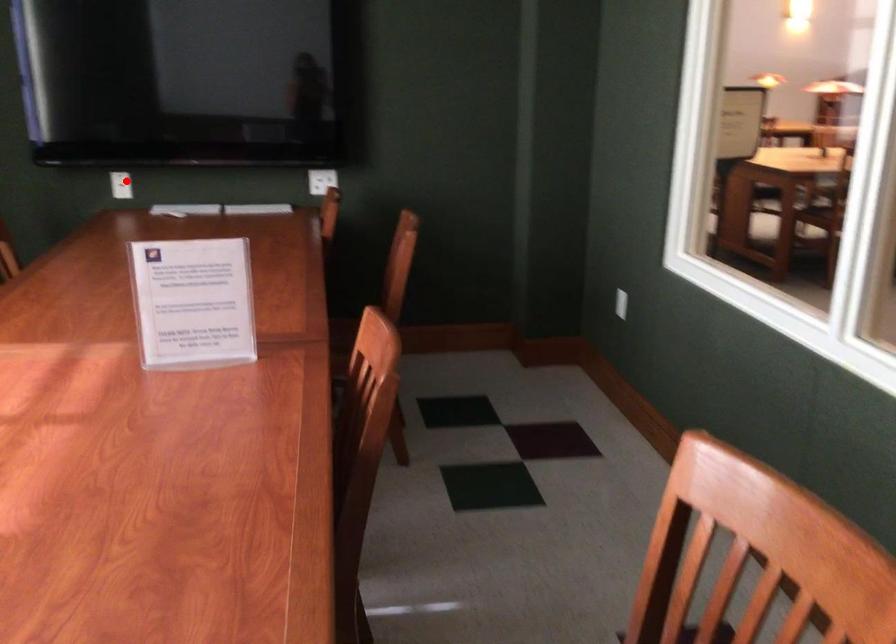
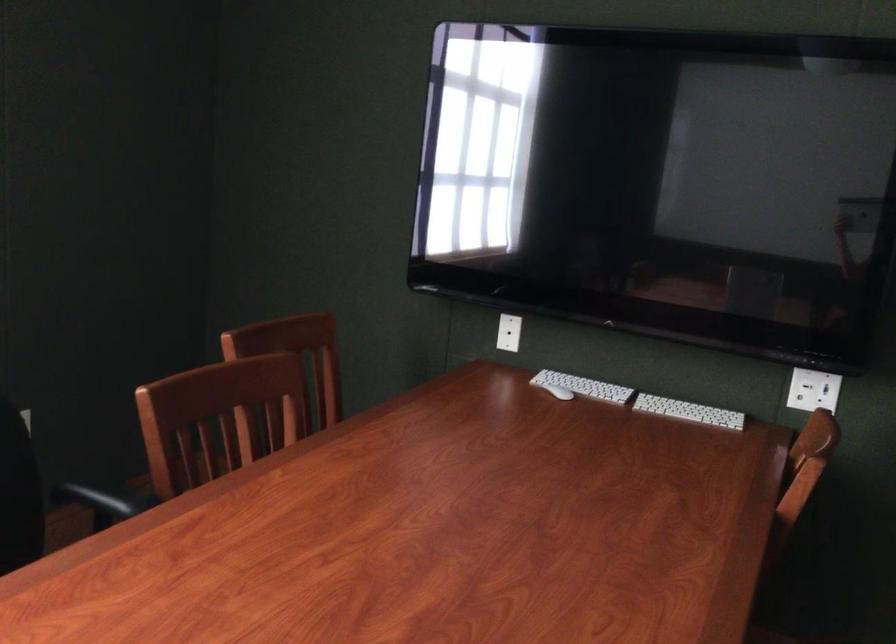
Question: I am providing you with two images of the same scene from different viewpoints. Image1 has a red point marked. In image2, the corresponding 3D location appears at what relative position? Reply with the corresponding letter.

Choices:
 (A) Closer
 (B) Farther

Answer: (A)